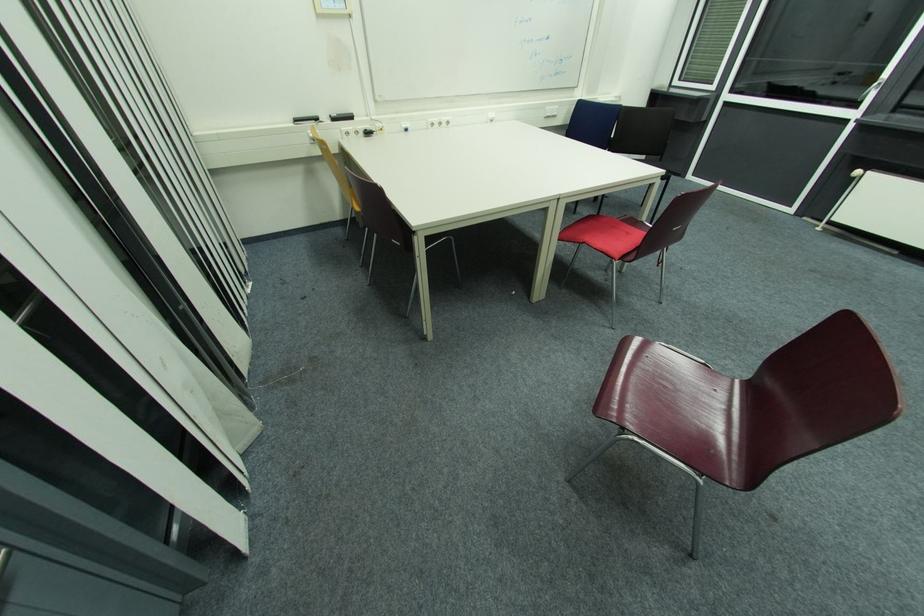
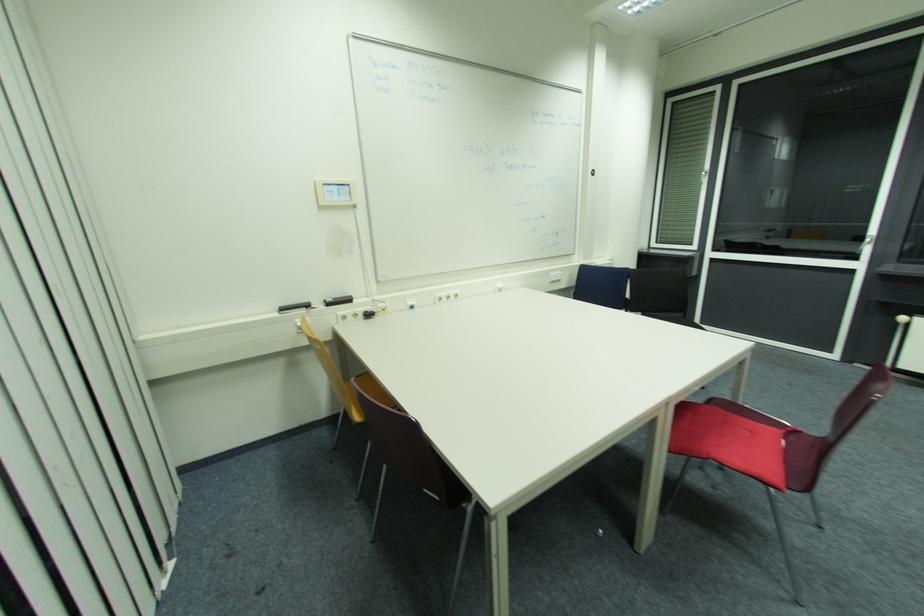
Which direction would the cameraman need to move to produce the second image?

The cameraman walked toward left, forward.